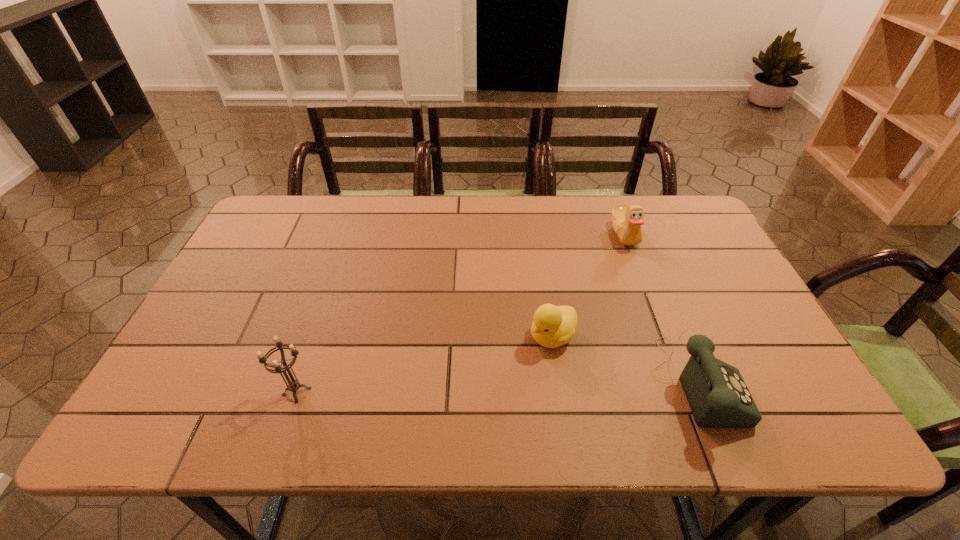
In the image, there is a desktop. Where is `vacant space at the near edge`? The width and height of the screenshot is (960, 540). vacant space at the near edge is located at coordinates (396, 369).

Locate an element on the screen. The height and width of the screenshot is (540, 960). free space at the left edge of the desktop is located at coordinates (236, 341).

Where is `free point at the right edge`? This screenshot has width=960, height=540. free point at the right edge is located at coordinates (715, 323).

The image size is (960, 540). I want to click on vacant space at the far left corner of the desktop, so click(x=277, y=212).

Find the location of a particular element. vacant space at the far right corner of the desktop is located at coordinates (675, 209).

Find the location of a particular element. vacant point located between the farther duck and the leftmost object is located at coordinates (461, 313).

Identify the location of vacant area that lies between the tallest object and the third object from right to left. (424, 364).

I want to click on free space between the farthest object and the third object from right to left, so click(588, 285).

Image resolution: width=960 pixels, height=540 pixels. Identify the location of free space between the third object from right to left and the candle holder. (424, 364).

What are the coordinates of `unoccupied position between the telephone and the candle holder` in the screenshot? It's located at pyautogui.click(x=496, y=388).